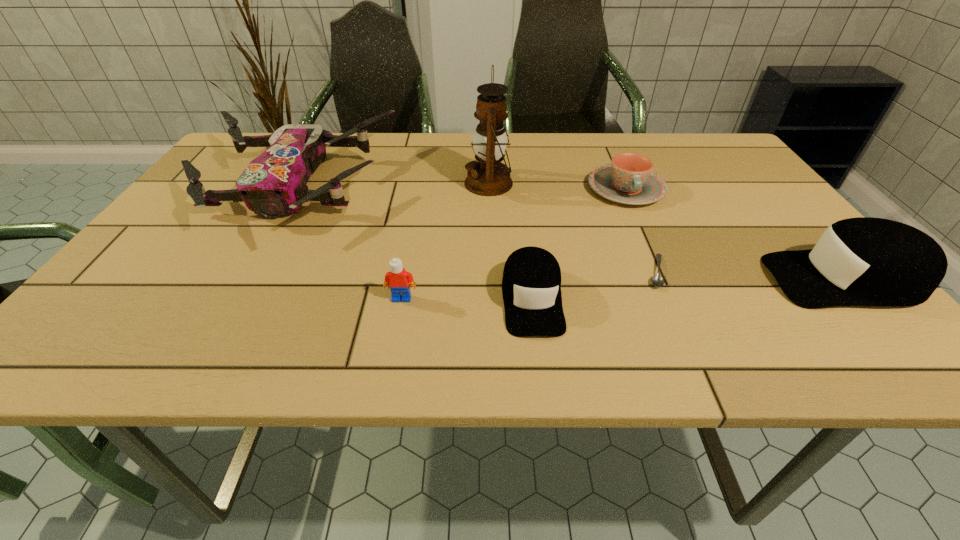
Locate an element on the screen. This screenshot has height=540, width=960. object identified as the fourth closest to the shorter cap is located at coordinates [x=488, y=177].

Find the location of a particular element. The height and width of the screenshot is (540, 960). free spot that satisfies the following two spatial constraints: 1. on the front-facing side of the shortest object; 2. on the right side of the leftmost object is located at coordinates 243,272.

Identify the location of free point that satisfies the following two spatial constraints: 1. on the front-facing side of the rightmost object; 2. on the face of the sixth object from right to left. (860, 298).

The image size is (960, 540). What are the coordinates of `vacant region that satisfies the following two spatial constraints: 1. on the side of the soupspoon, there is a wick adjustment knob; 2. on the left side of the lantern` in the screenshot? It's located at (491, 272).